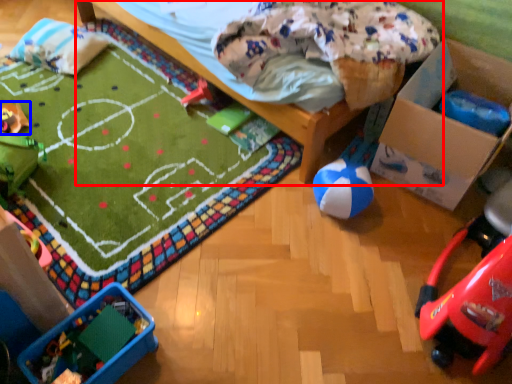
Question: Which object is closer to the camera taking this photo, furniture (highlighted by a red box) or toy (highlighted by a blue box)?

Choices:
 (A) furniture
 (B) toy

Answer: (A)